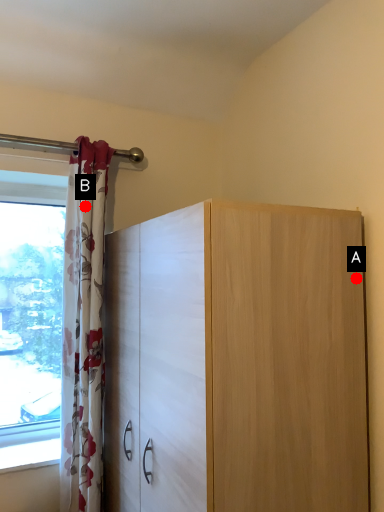
Question: Two points are circled on the image, labeled by A and B beside each circle. Which point is further to the camera?

Choices:
 (A) A is further
 (B) B is further

Answer: (B)